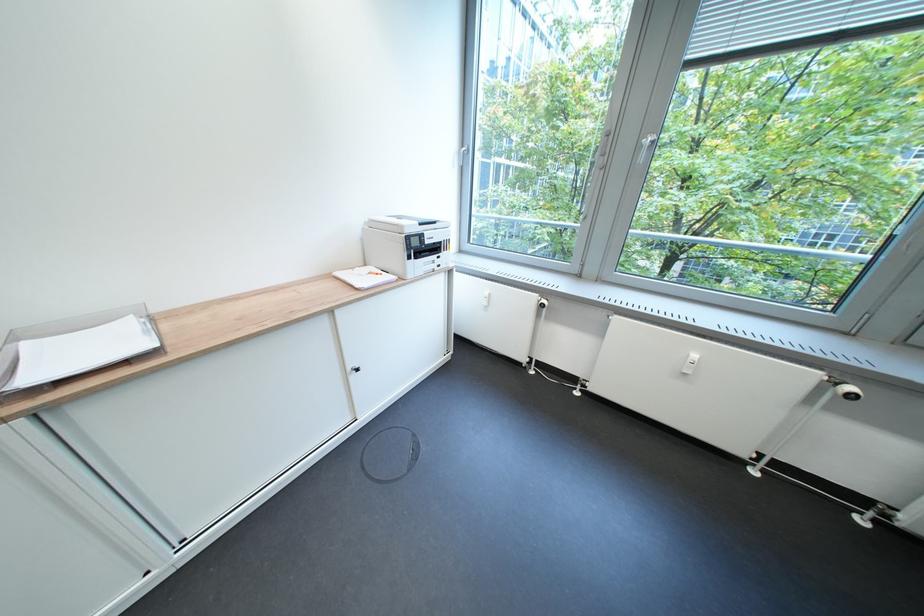
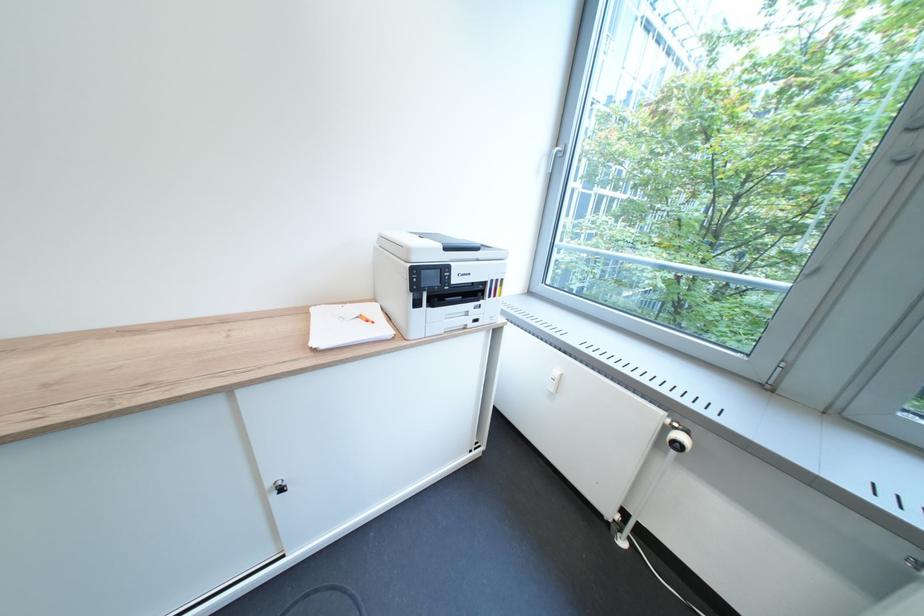
Question: What movement of the cameraman would produce the second image?

Choices:
 (A) Left
 (B) Right
 (C) Forward
 (D) Backward

Answer: (C)